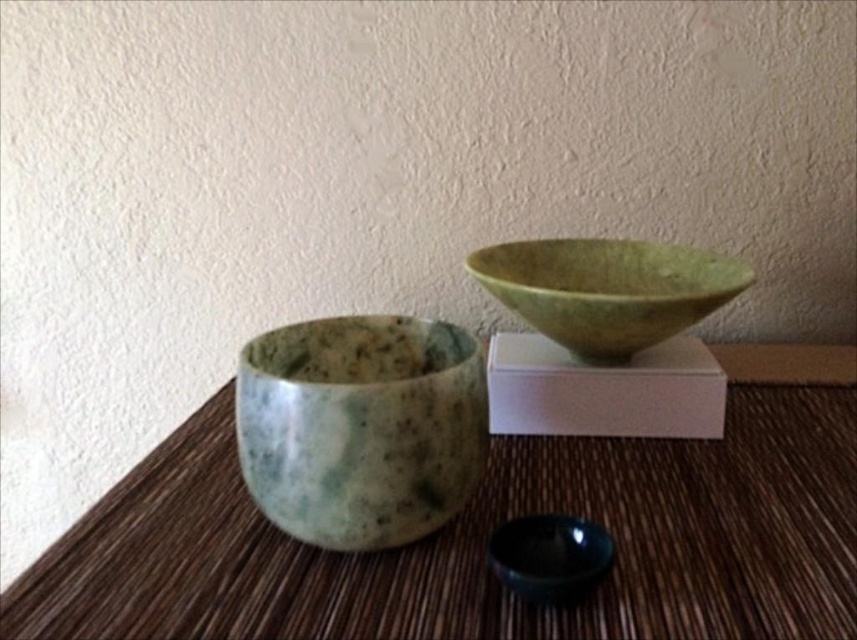
Question: Which of the following is the closest to the observer?

Choices:
 (A) (738, 292)
 (B) (585, 544)

Answer: (B)

Question: Which object is positioned closest to the speckled stone bowl at center?

Choices:
 (A) green marble bowl at upper center
 (B) black glossy bowl at lower center
 (C) brown woven mat at center

Answer: (B)

Question: Where is brown woven mat at center located in relation to speckled stone bowl at center in the image?

Choices:
 (A) right
 (B) left

Answer: (A)

Question: Is brown woven mat at center below green marble bowl at upper center?

Choices:
 (A) no
 (B) yes

Answer: (B)

Question: Which of the following is the closest to the observer?

Choices:
 (A) green marble bowl at upper center
 (B) brown woven mat at center
 (C) speckled stone bowl at center

Answer: (B)

Question: Can you confirm if speckled stone bowl at center is bigger than black glossy bowl at lower center?

Choices:
 (A) yes
 (B) no

Answer: (A)